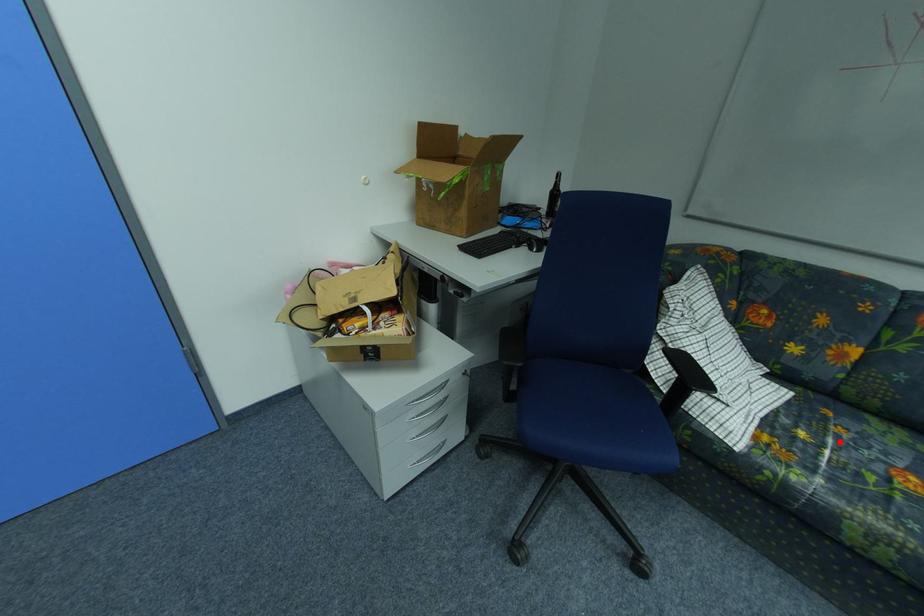
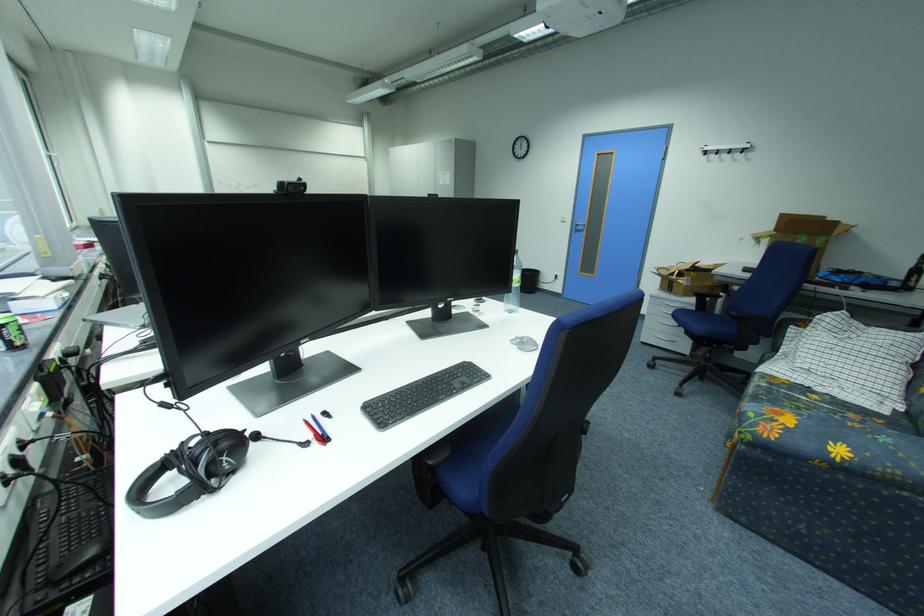
Question: I am providing you with two images of the same scene from different viewpoints. A red point is shown in image1. For the corresponding object point in image2, is it positioned nearer or farther from the camera?

Choices:
 (A) Nearer
 (B) Farther

Answer: (B)